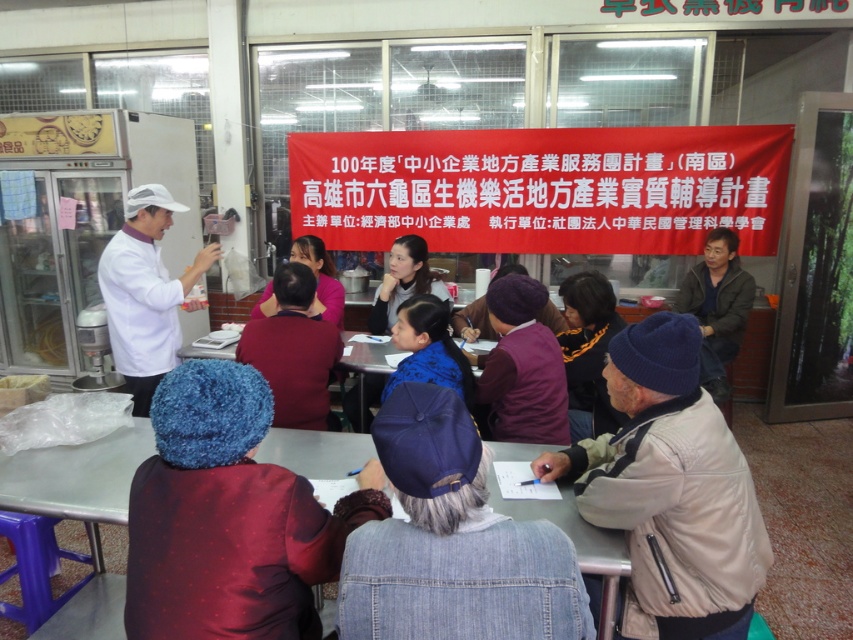
Does point (189, 269) come closer to viewer compared to point (596, 369)?

No, it is behind (596, 369).

Find the location of a particular element. The width and height of the screenshot is (853, 640). white lab coat at left is located at coordinates (146, 292).

Identify the location of white lab coat at left. (146, 292).

Does purple denim jacket at center have a greater height compared to purple woolen hat at center?

Incorrect, purple denim jacket at center's height is not larger of purple woolen hat at center's.

Does purple denim jacket at center have a lesser height compared to purple woolen hat at center?

Yes, purple denim jacket at center is shorter than purple woolen hat at center.

Identify the location of purple denim jacket at center. This screenshot has height=640, width=853. (451, 541).

Looking at this image, measure the distance between white lab coat at left and blue fabric scarf at center.

The distance of white lab coat at left from blue fabric scarf at center is 1.16 meters.

Can you confirm if white lab coat at left is positioned to the left of blue fabric scarf at center?

Yes, white lab coat at left is to the left of blue fabric scarf at center.

Is point (149, 394) less distant than point (410, 321)?

No, (149, 394) is further to viewer.

Find the location of a particular element. The width and height of the screenshot is (853, 640). white lab coat at left is located at coordinates (146, 292).